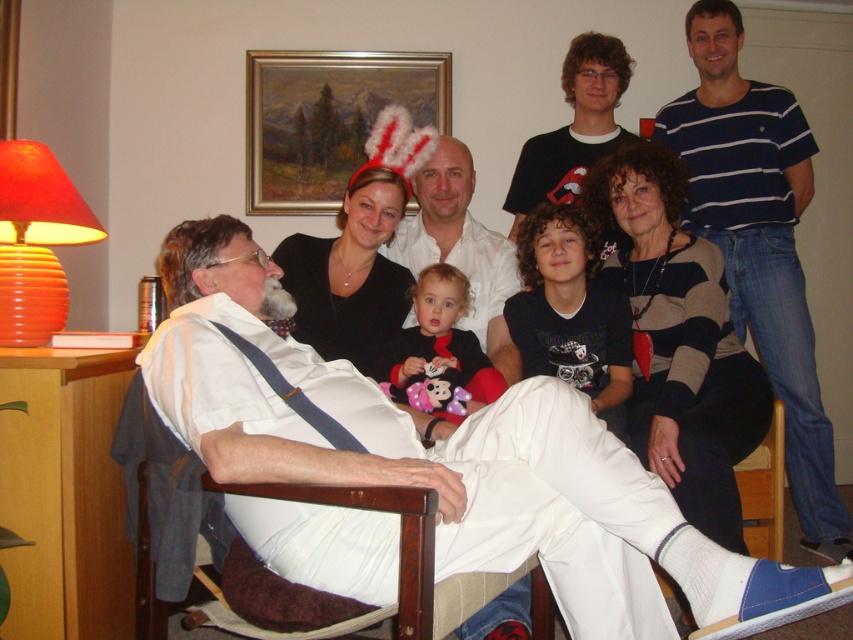
You are planning to place the soft plush toy at center on the wooden armchair at lower left. Considering their sizes, will the plush toy fit comfortably on the chair?

The wooden armchair at lower left is wider than the soft plush toy at center, so the toy will fit comfortably on the chair.

You are standing in the living room and want to find the blue striped shirt at upper right. According to the scene description, where should you look to locate it?

The blue striped shirt at upper right is located at point (759, 243), so you should look towards the upper right area of the scene to find it.

You are standing in the living room and want to place a small potted plant at the point marked as point (196, 518). Considering the distance from where you are standing to this point is 4.97 feet, will you need to move forward or backward to reach it?

The distance of point (196, 518) from the camera is 4.97 feet, so you will need to move forward 4.97 feet to reach it.